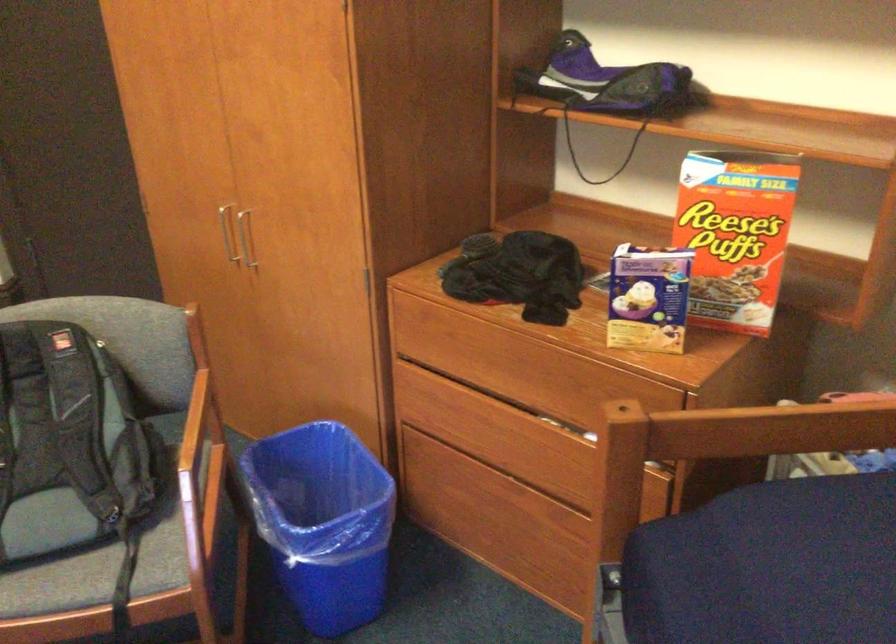
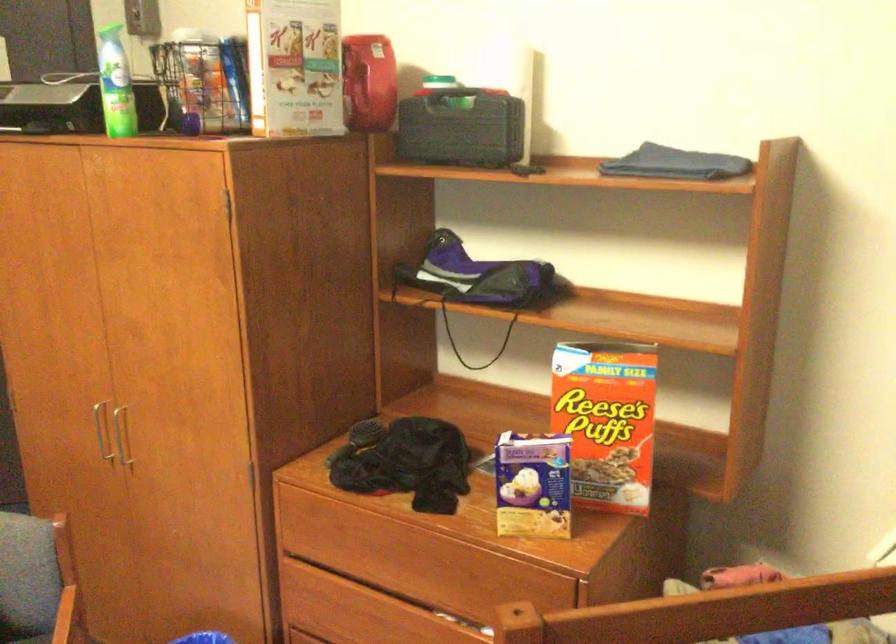
Which direction would the cameraman need to move to produce the second image?

The movement direction of the cameraman is left, backward.